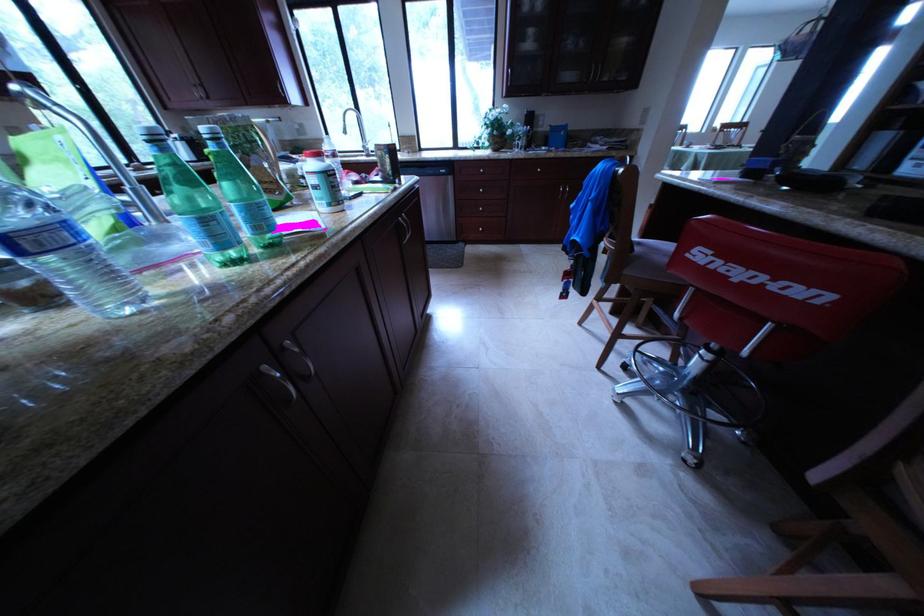
Find the location of a particular element. The height and width of the screenshot is (616, 924). silver cabinet handle is located at coordinates (201, 92).